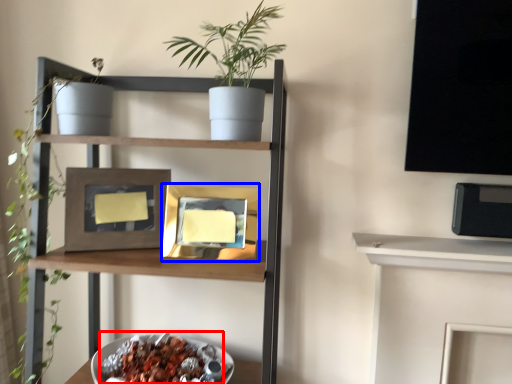
Question: Which of the following is the farthest to the observer, food (highlighted by a red box) or picture frame (highlighted by a blue box)?

Choices:
 (A) food
 (B) picture frame

Answer: (B)